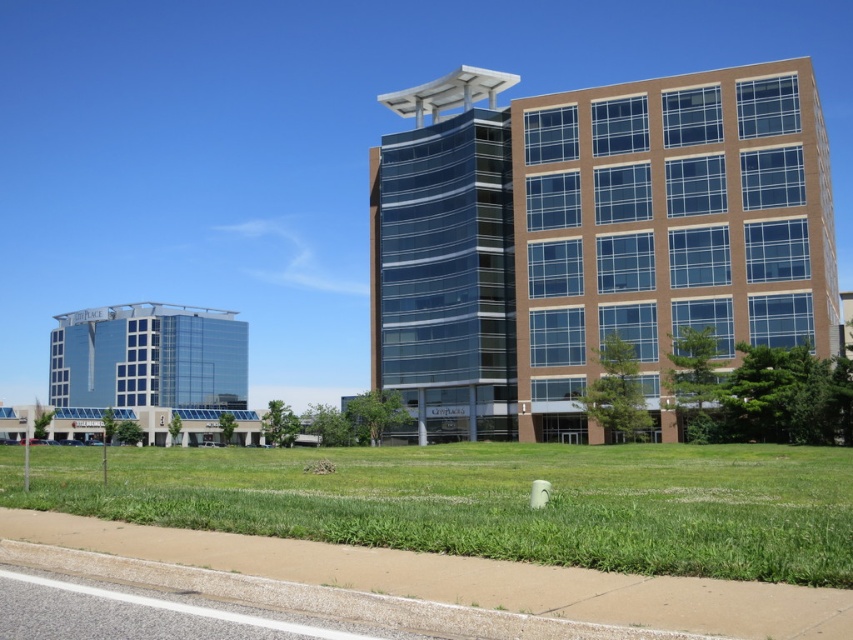
Who is shorter, brown glass building at center or green grass at lower center?

green grass at lower center is shorter.

Does brown glass building at center appear under green grass at lower center?

No.

Which is behind, point (495, 230) or point (173, 472)?

Point (495, 230)

You are a GUI agent. You are given a task and a screenshot of the screen. Output one action in this format:
    pyautogui.click(x=<x>, y=<y>)
    Task: Click on the brown glass building at center
    The height and width of the screenshot is (640, 853).
    Given the screenshot: What is the action you would take?
    pyautogui.click(x=590, y=237)